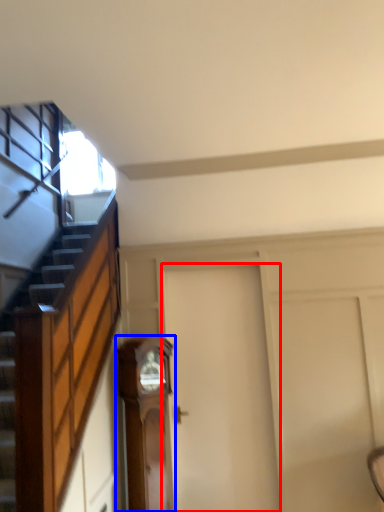
Question: Which point is closer to the camera, door (highlighted by a red box) or furniture (highlighted by a blue box)?

Choices:
 (A) door
 (B) furniture

Answer: (B)